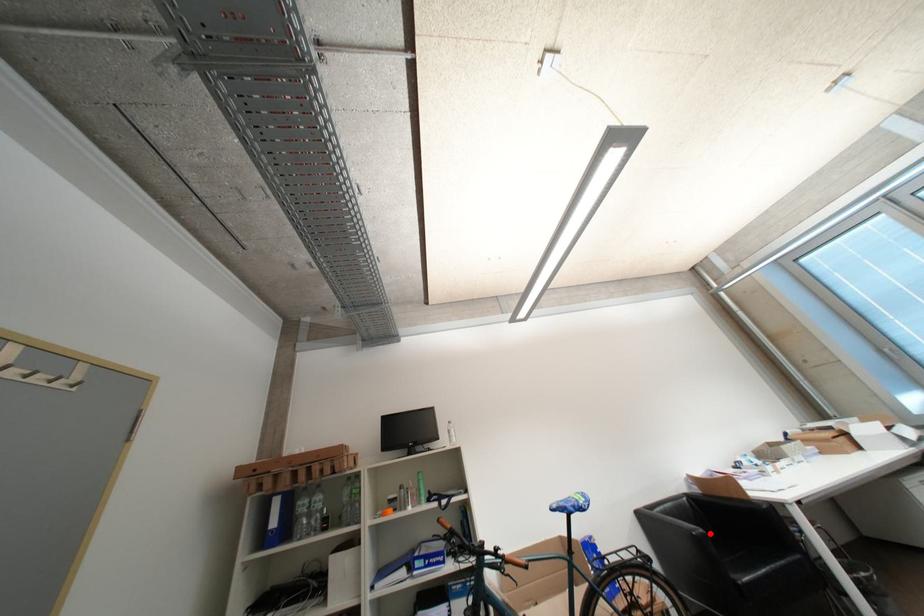
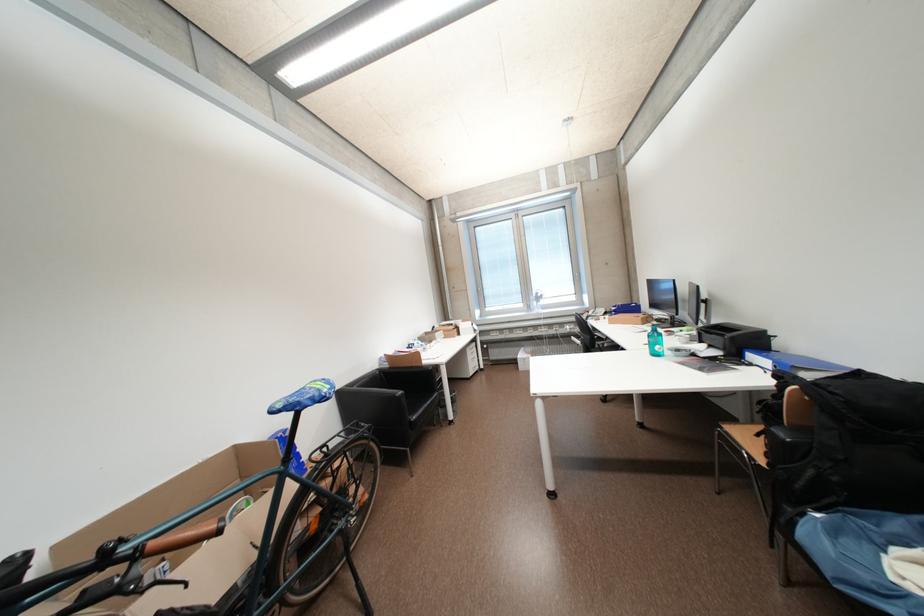
In the second image, find the point that corresponds to the highlighted location in the first image.

(408, 394)